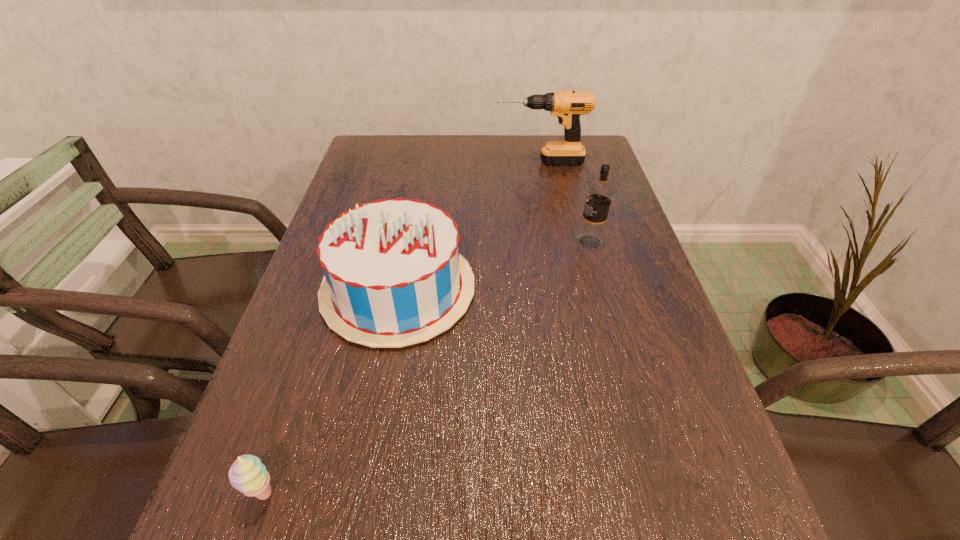
Where is `free space that is in between the vodka and the birthday cake`? free space that is in between the vodka and the birthday cake is located at coordinates (493, 266).

Find the location of `vacant area that lies between the nearest object and the vodka`. vacant area that lies between the nearest object and the vodka is located at coordinates (426, 368).

Image resolution: width=960 pixels, height=540 pixels. I want to click on free space between the birthday cake and the vodka, so click(493, 266).

Locate an element on the screen. Image resolution: width=960 pixels, height=540 pixels. the second closest object relative to the birthday cake is located at coordinates (599, 195).

Locate an element on the screen. object that is the nearest to the birthday cake is located at coordinates (247, 474).

I want to click on vacant region that satisfies the following two spatial constraints: 1. at the tip of the farthest object; 2. on the front side of the nearest object, so click(x=605, y=495).

The image size is (960, 540). Identify the location of free point that satisfies the following two spatial constraints: 1. on the back side of the nearest object; 2. on the left side of the birthday cake. (333, 289).